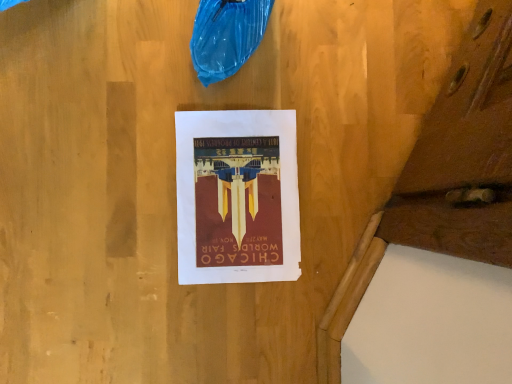
Question: Should I look upward or downward to see matte paper poster at center?

Choices:
 (A) up
 (B) down

Answer: (B)